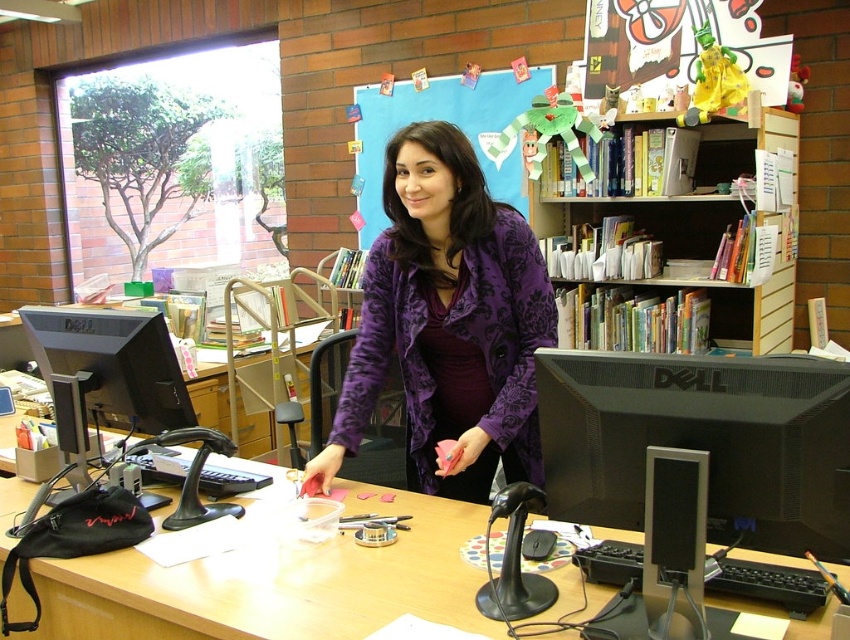
Question: Can you confirm if black matte monitor at center is positioned below wooden at center?

Choices:
 (A) no
 (B) yes

Answer: (A)

Question: Among these points, which one is nearest to the camera?

Choices:
 (A) (179, 586)
 (B) (490, 129)
 (C) (89, 316)
 (D) (496, 440)

Answer: (A)

Question: Which point is closer to the camera?

Choices:
 (A) click(656, 346)
 (B) click(398, 269)
 (C) click(429, 81)

Answer: (B)

Question: Which point is farther to the camera?

Choices:
 (A) (480, 368)
 (B) (659, 163)
 (C) (391, 609)
 (D) (443, 93)

Answer: (D)

Question: Is purple velvet jacket at center to the right of wooden at center from the viewer's perspective?

Choices:
 (A) no
 (B) yes

Answer: (B)

Question: Does purple velvet jacket at center come behind black matte monitor at center?

Choices:
 (A) no
 (B) yes

Answer: (B)